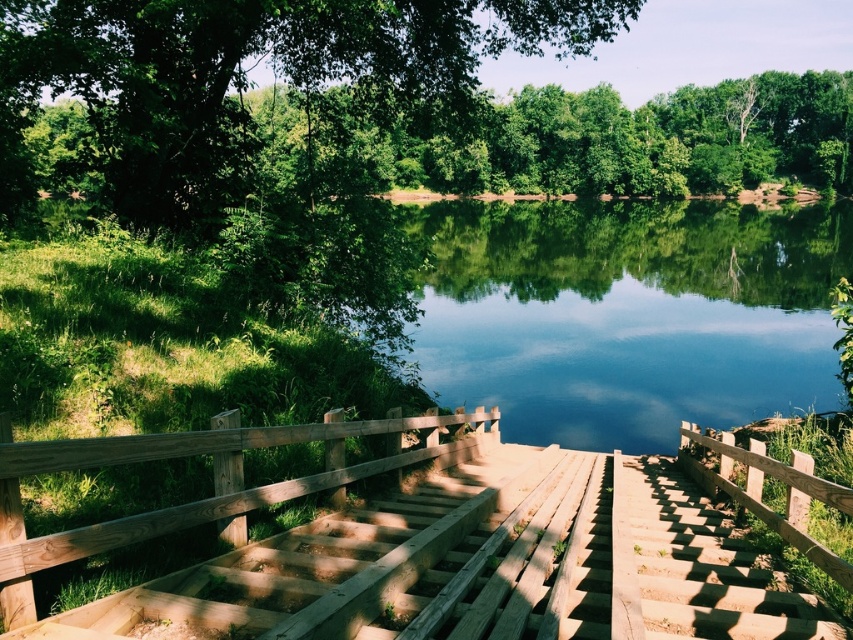
You are standing on the wooden stairs at center and want to reach the green leafy tree at upper center. Which direction should you move to get closer to the tree?

The green leafy tree at upper center is positioned over the wooden stairs at center, so you should move upward or forward towards the tree to get closer.

You are planning to cross the wooden bridge at center to reach the other side of the green smooth water at center. Based on their sizes, which one is lower in height?

The wooden bridge at center is shorter than the green smooth water at center, so the wooden bridge at center is lower in height.